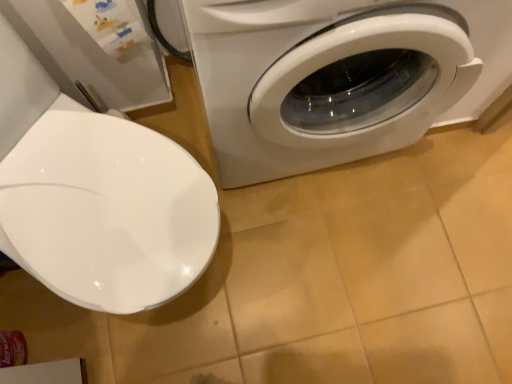
Locate an element on the screen. vacant area that lies in front of white glossy washing machine at right is located at coordinates (330, 261).